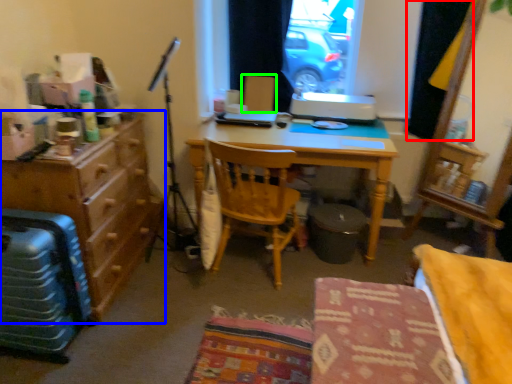
Question: Based on their relative distances, which object is farther from curtain (highlighted by a red box)? Choose from cabinetry (highlighted by a blue box) and armchair (highlighted by a green box).

Choices:
 (A) cabinetry
 (B) armchair

Answer: (A)